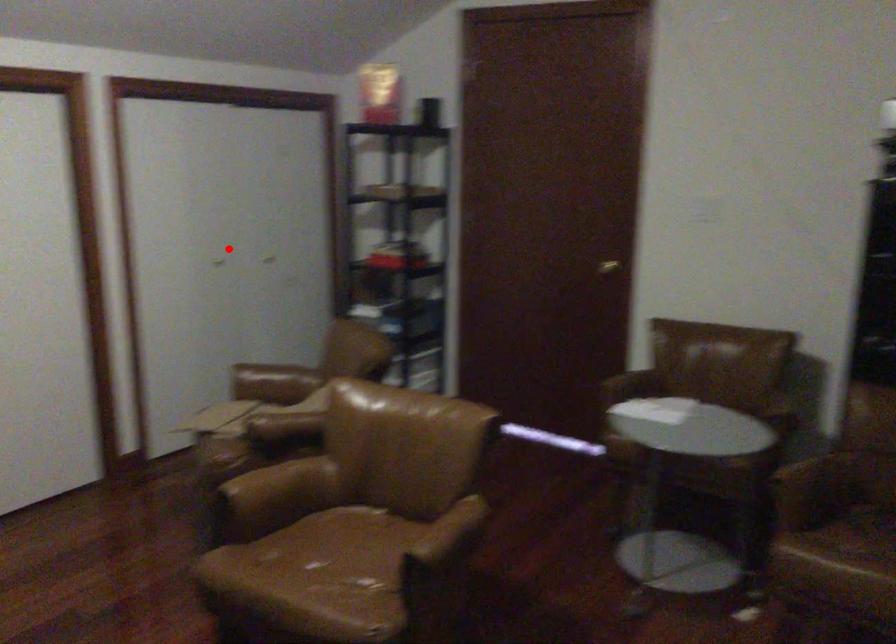
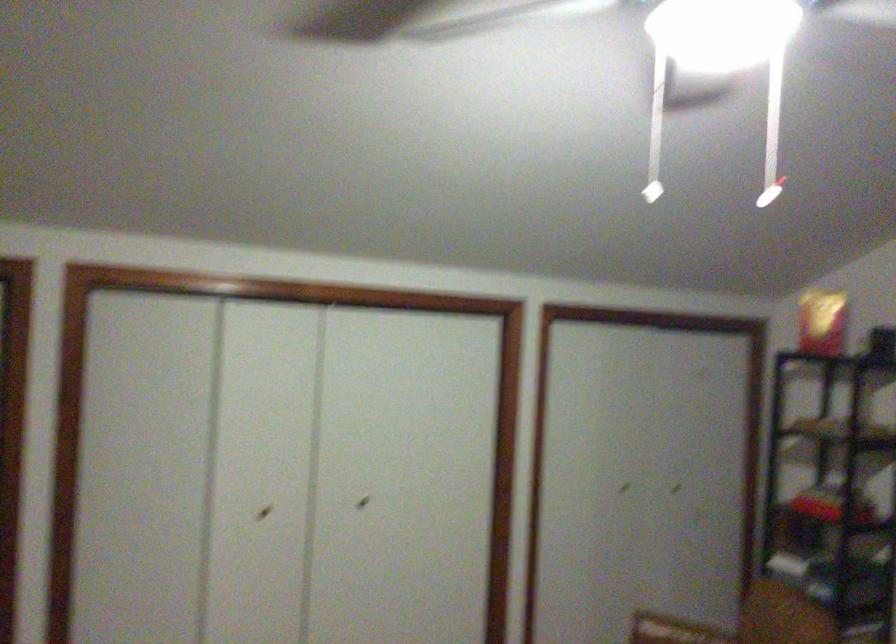
Find the pixel in the second image that matches the highlighted location in the first image.

(623, 488)